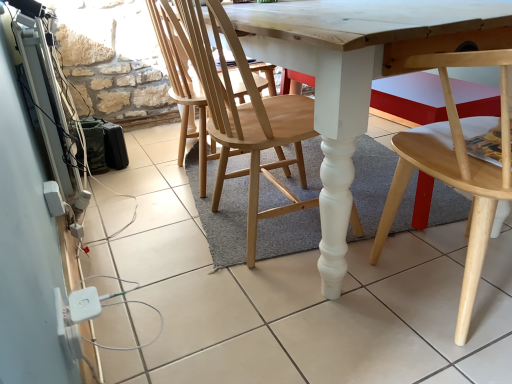
Locate an element on the screen. Image resolution: width=512 pixels, height=384 pixels. vacant area that is situated to the right of natural wood chair at center, the 2th chair when ordered from right to left is located at coordinates (378, 211).